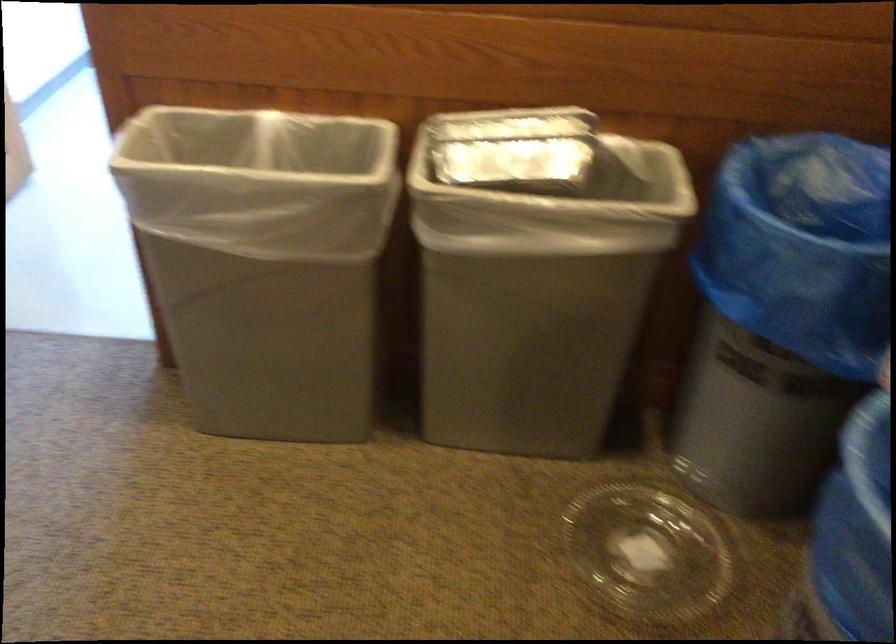
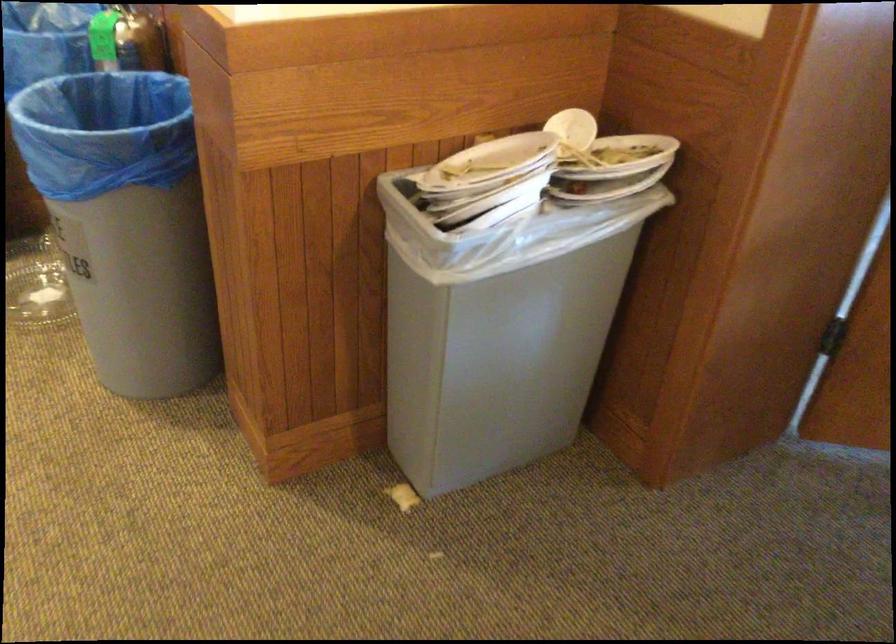
Find the pixel in the second image that matches the point at 629,514 in the first image.

(36, 285)